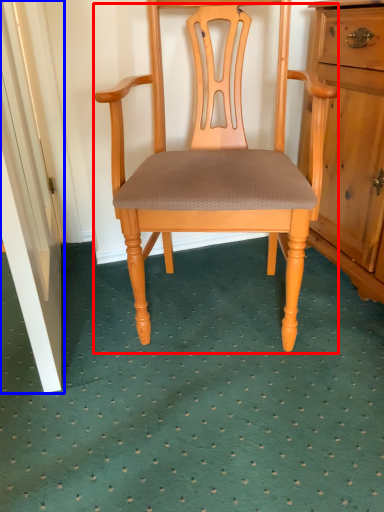
Question: Which object is further to the camera taking this photo, chair (highlighted by a red box) or door (highlighted by a blue box)?

Choices:
 (A) chair
 (B) door

Answer: (A)